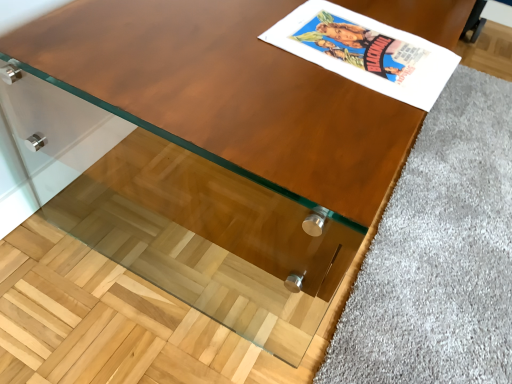
Question: Relative to matte paper comic book at upper right, is soft gray carpet at lower right in front or behind?

Choices:
 (A) behind
 (B) front

Answer: (A)

Question: Is point (437, 291) closer or farther from the camera than point (413, 100)?

Choices:
 (A) farther
 (B) closer

Answer: (A)

Question: Is soft gray carpet at lower right wider or thinner than matte paper comic book at upper right?

Choices:
 (A) thin
 (B) wide

Answer: (B)

Question: Do you think matte paper comic book at upper right is within soft gray carpet at lower right, or outside of it?

Choices:
 (A) inside
 (B) outside

Answer: (B)

Question: Is matte paper comic book at upper right in front of or behind soft gray carpet at lower right in the image?

Choices:
 (A) front
 (B) behind

Answer: (A)

Question: Is matte paper comic book at upper right taller or shorter than soft gray carpet at lower right?

Choices:
 (A) short
 (B) tall

Answer: (B)

Question: Considering the positions of matte paper comic book at upper right and soft gray carpet at lower right in the image, is matte paper comic book at upper right bigger or smaller than soft gray carpet at lower right?

Choices:
 (A) small
 (B) big

Answer: (A)